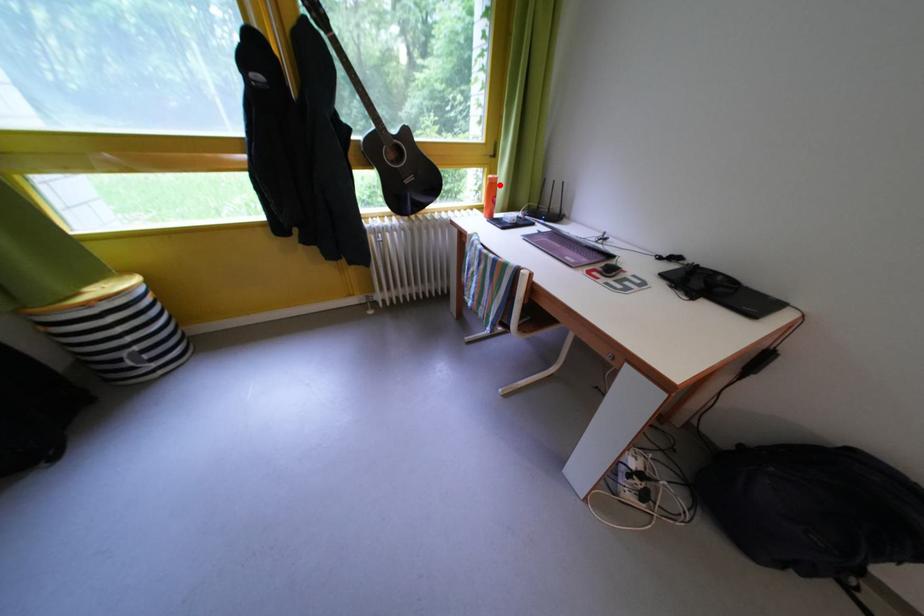
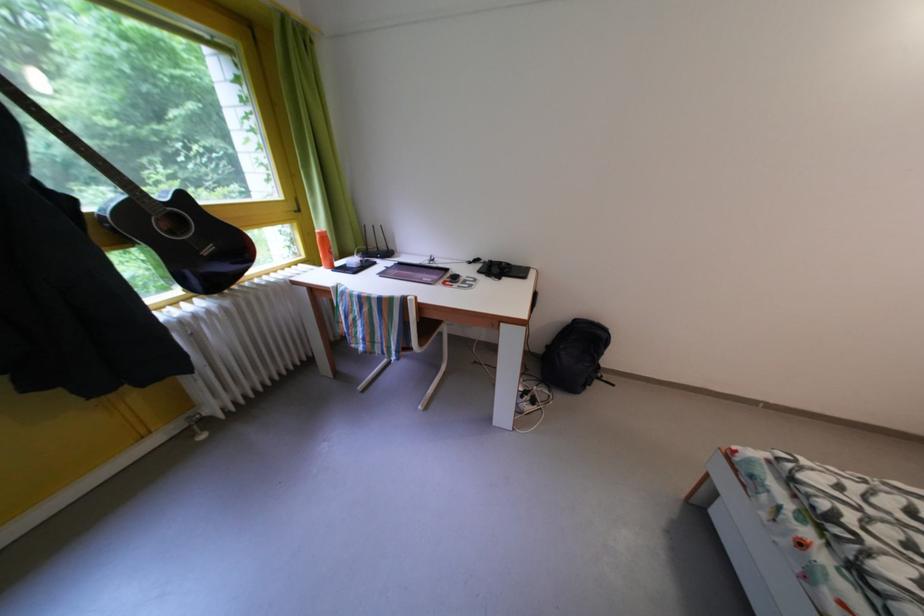
Question: I am providing you with two images of the same scene from different viewpoints. Given a red point in image1, look at the same physical point in image2. Is it:

Choices:
 (A) Closer to the viewpoint
 (B) Farther from the viewpoint

Answer: (B)